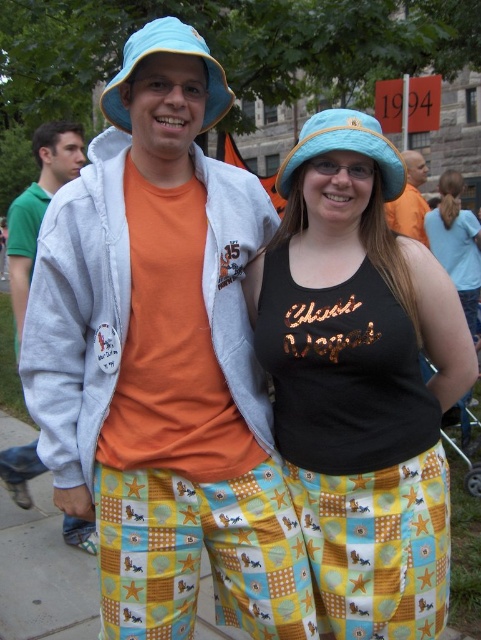
Measure the distance from matte blue hat at center to orange cotton shirt at left.

A distance of 6.22 feet exists between matte blue hat at center and orange cotton shirt at left.

Does matte blue hat at center appear over orange cotton shirt at left?

No, matte blue hat at center is not above orange cotton shirt at left.

Is point (344, 461) closer to viewer compared to point (51, 182)?

Yes, it is.

Where is `matte blue hat at center`? The image size is (481, 640). matte blue hat at center is located at coordinates (361, 380).

Who is positioned more to the right, matte blue hat at center or matte black tank top at center?

matte black tank top at center is more to the right.

Is matte blue hat at center further to camera compared to matte black tank top at center?

That is False.

Between point (317, 305) and point (429, 221), which one is positioned behind?

The point (429, 221) is more distant.

Image resolution: width=481 pixels, height=640 pixels. In order to click on matte blue hat at center in this screenshot , I will do `click(361, 380)`.

Is matte blue hat at center wider than matte blue fabric bucket hat at upper center?

Indeed, matte blue hat at center has a greater width compared to matte blue fabric bucket hat at upper center.

Measure the distance between matte blue hat at center and camera.

8.27 feet

Which is in front, point (325, 344) or point (176, 35)?

Point (325, 344) is in front.

Locate an element on the screen. This screenshot has height=640, width=481. matte blue hat at center is located at coordinates (361, 380).